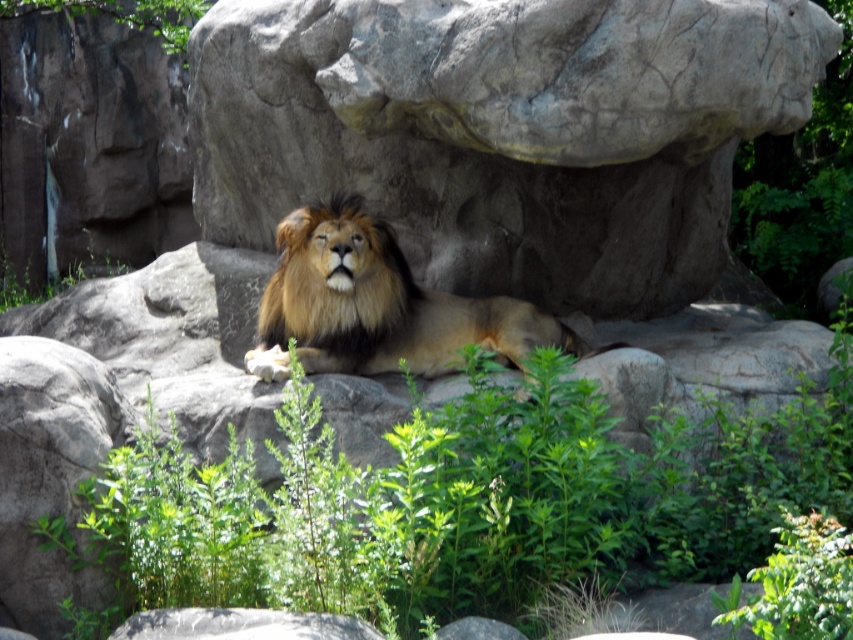
Question: Considering the relative positions of green leafy plant at center and golden fur lion at center in the image provided, where is green leafy plant at center located with respect to golden fur lion at center?

Choices:
 (A) below
 (B) above

Answer: (A)

Question: Is gray rough rock at center closer to camera compared to green leafy plant at center?

Choices:
 (A) yes
 (B) no

Answer: (B)

Question: Which object is farther from the camera taking this photo?

Choices:
 (A) green leafy plant at center
 (B) golden fur lion at center
 (C) gray rough rock at center

Answer: (B)

Question: Estimate the real-world distances between objects in this image. Which object is farther from the green leafy plant at center?

Choices:
 (A) gray rough rock at center
 (B) golden fur lion at center

Answer: (A)

Question: In this image, where is gray rough rock at center located relative to green leafy plant at center?

Choices:
 (A) left
 (B) right

Answer: (A)

Question: Which object is closer to the camera taking this photo?

Choices:
 (A) green leafy plant at center
 (B) golden fur lion at center
 (C) gray rough rock at center

Answer: (A)